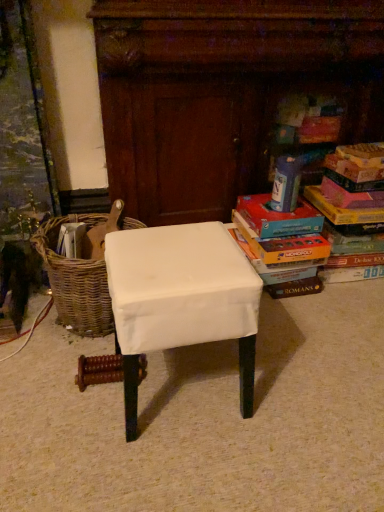
At what (x,y) coordinates should I click in order to perform the action: click on vacant space in white fabric-covered stool at center (from a real-world perspective). Please return your answer as a coordinate pair (x, y). The width and height of the screenshot is (384, 512). Looking at the image, I should click on (182, 380).